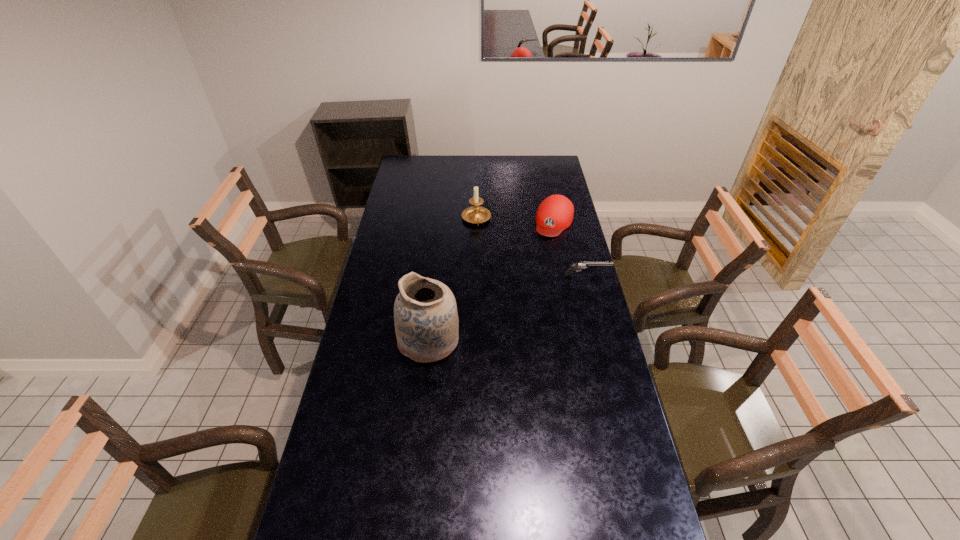
You are a GUI agent. You are given a task and a screenshot of the screen. Output one action in this format:
    pyautogui.click(x=<x>, y=<y>)
    Task: Click on the free space on the desktop that is between the nearest object and the shortest object and is positioned on the front-facing side of the third tallest object
    
    Given the screenshot: What is the action you would take?
    pyautogui.click(x=514, y=305)

Find the location of `vacant space on the desktop that is between the tallest object and the second nearest object and is positioned with a handle on the side of the candle holder`. vacant space on the desktop that is between the tallest object and the second nearest object and is positioned with a handle on the side of the candle holder is located at coordinates (502, 310).